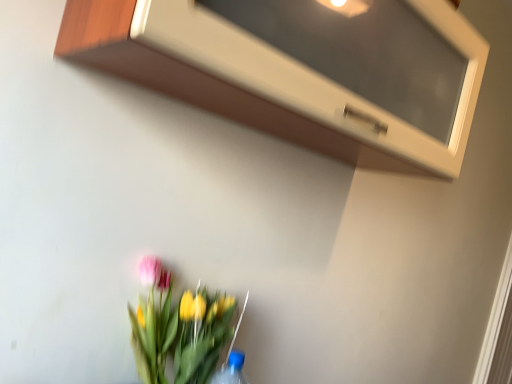
Question: Is vibrant floral bouquet at lower center placed right next to white glossy microwave at upper center?

Choices:
 (A) yes
 (B) no

Answer: (B)

Question: From the image's perspective, is vibrant floral bouquet at lower center above white glossy microwave at upper center?

Choices:
 (A) no
 (B) yes

Answer: (A)

Question: Is white glossy microwave at upper center located within vibrant floral bouquet at lower center?

Choices:
 (A) no
 (B) yes

Answer: (A)

Question: From a real-world perspective, is vibrant floral bouquet at lower center physically above white glossy microwave at upper center?

Choices:
 (A) yes
 (B) no

Answer: (B)

Question: Does vibrant floral bouquet at lower center appear on the left side of white glossy microwave at upper center?

Choices:
 (A) yes
 (B) no

Answer: (A)

Question: Is vibrant floral bouquet at lower center outside white glossy microwave at upper center?

Choices:
 (A) no
 (B) yes

Answer: (B)

Question: Is white glossy microwave at upper center at the left side of vibrant floral bouquet at lower center?

Choices:
 (A) yes
 (B) no

Answer: (B)

Question: Is white glossy microwave at upper center placed right next to vibrant floral bouquet at lower center?

Choices:
 (A) no
 (B) yes

Answer: (A)

Question: From the image's perspective, is white glossy microwave at upper center below vibrant floral bouquet at lower center?

Choices:
 (A) no
 (B) yes

Answer: (A)

Question: Is white glossy microwave at upper center not inside vibrant floral bouquet at lower center?

Choices:
 (A) no
 (B) yes

Answer: (B)

Question: Can you confirm if white glossy microwave at upper center is shorter than vibrant floral bouquet at lower center?

Choices:
 (A) yes
 (B) no

Answer: (B)

Question: Is white glossy microwave at upper center surrounding vibrant floral bouquet at lower center?

Choices:
 (A) no
 (B) yes

Answer: (A)

Question: Is point (168, 0) positioned closer to the camera than point (224, 297)?

Choices:
 (A) closer
 (B) farther

Answer: (A)